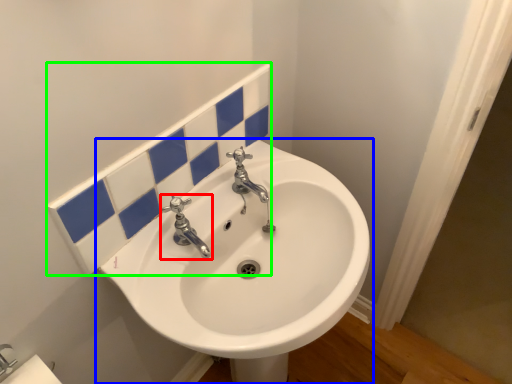
Question: Which object is positioned closest to tap (highlighted by a red box)? Select from sink (highlighted by a blue box) and tile (highlighted by a green box).

Choices:
 (A) sink
 (B) tile

Answer: (B)